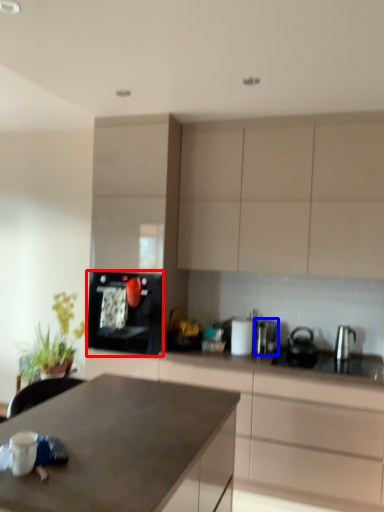
Question: Among these objects, which one is farthest to the camera, kitchen appliance (highlighted by a red box) or appliance (highlighted by a blue box)?

Choices:
 (A) kitchen appliance
 (B) appliance

Answer: (B)